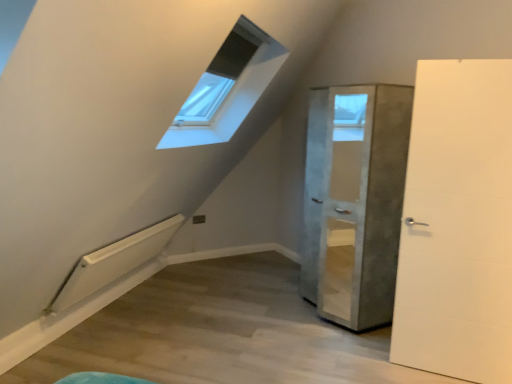
Find the location of a particular element. This screenshot has width=512, height=384. vacant space that is to the left of white matte door at right, marked as the 2th door in a back-to-front arrangement is located at coordinates (375, 366).